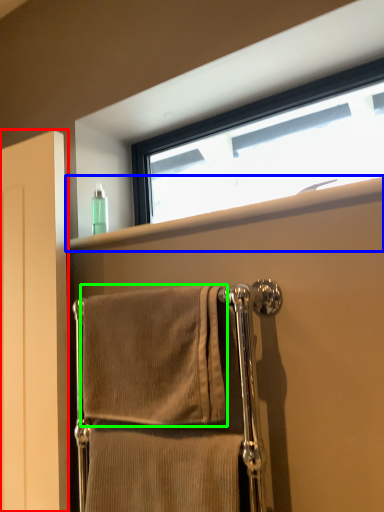
Question: Which object is the farthest from screen door (highlighted by a red box)? Choose among these: window sill (highlighted by a blue box) or towel (highlighted by a green box).

Choices:
 (A) window sill
 (B) towel

Answer: (A)